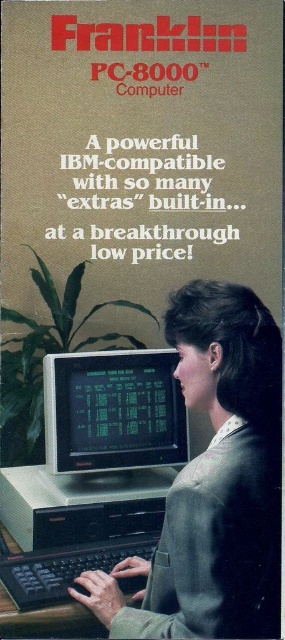
You are a graphic designer reviewing this advertisement. You need to ensure that the matte gray suit at center and the black plastic keyboard at lower center are aligned correctly. According to the spatial arrangement, which object is placed to the right of the other?

The matte gray suit at center is positioned on the right side of black plastic keyboard at lower center, so the matte gray suit at center is to the right of the black plastic keyboard at lower center.

In the advertisement for the Franklin PC 8000, there is a woman wearing a matte gray suit at center and using a green matte monitor at center. Which object occupies more space in the image?

The matte gray suit at center has a larger size compared to the green matte monitor at center, so the matte gray suit at center occupies more space in the image.